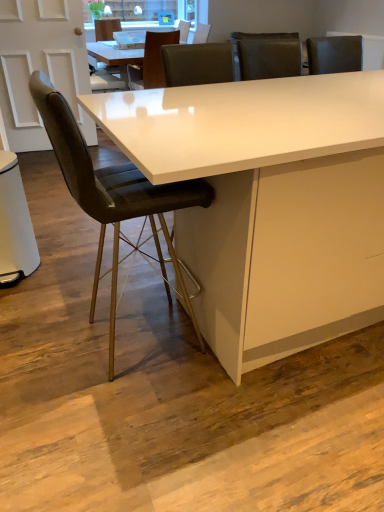
Locate an element on the screen. This screenshot has height=512, width=384. vacant space situated above white glossy table at center (from a real-world perspective) is located at coordinates (274, 97).